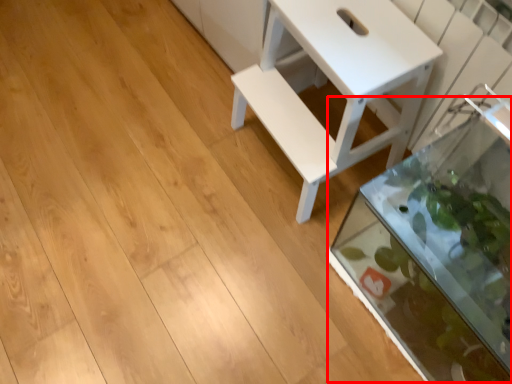
Question: In this image, where is glass box (annotated by the red box) located relative to table?

Choices:
 (A) right
 (B) left

Answer: (A)